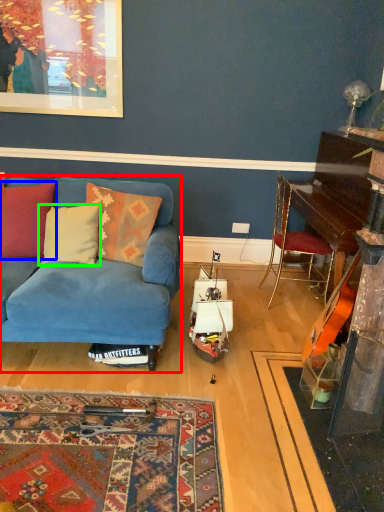
Question: Which is farther away from studio couch (highlighted by a red box)? pillow (highlighted by a blue box) or pillow (highlighted by a green box)?

Choices:
 (A) pillow
 (B) pillow

Answer: (A)